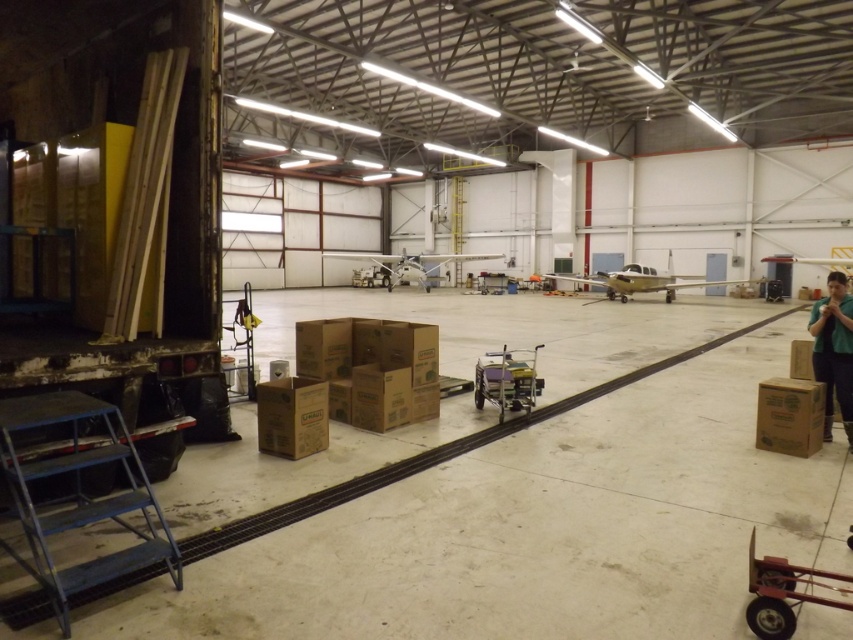
You are standing at the entrance of the hangar and see a point marked at coordinates (x=784, y=593). What object is this point located on?

The point marked at coordinates (x=784, y=593) is located on the metallic red handcart at lower right.

Looking at this image, where is the green fabric shirt at right located in the image?

The green fabric shirt at right is located at point (833, 349) in the image.

You are a maintenance worker in the hangar and need to reach the step ladder attached to the truck on the left. The green fabric shirt at right and brown cardboard box at lower right are in your way. Which object must you move first to access the ladder?

You must move the brown cardboard box at lower right first because it is behind the green fabric shirt at right, meaning the box is closer to you and blocking the path to the ladder.